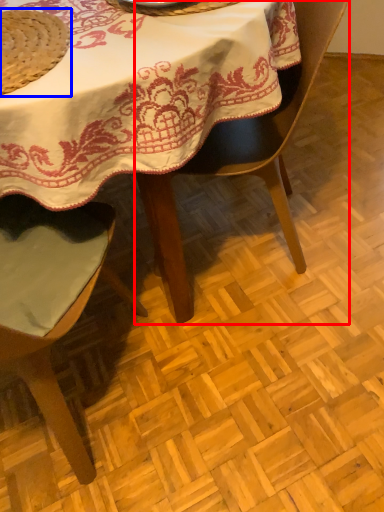
Question: Which object is further to the camera taking this photo, chair (highlighted by a red box) or straw hat (highlighted by a blue box)?

Choices:
 (A) chair
 (B) straw hat

Answer: (A)